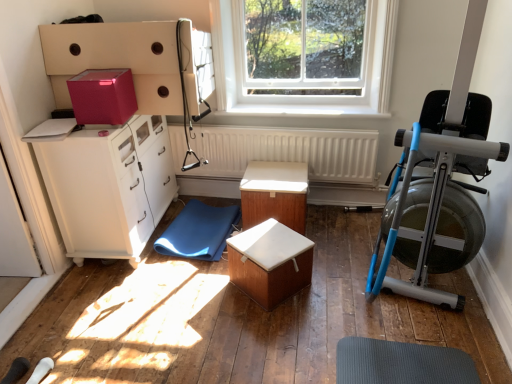
This screenshot has height=384, width=512. I want to click on vacant area in front of matte white cabinet at left, so click(119, 305).